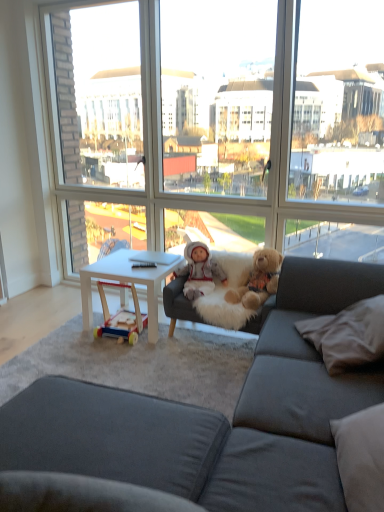
Question: Should I look upward or downward to see fluffy brown teddy bear at center?

Choices:
 (A) up
 (B) down

Answer: (B)

Question: Is white plush doll at center thinner than dark gray fabric couch at center?

Choices:
 (A) no
 (B) yes

Answer: (B)

Question: Can you confirm if white plush doll at center is positioned to the right of dark gray fabric couch at center?

Choices:
 (A) no
 (B) yes

Answer: (A)

Question: Can you confirm if white plush doll at center is shorter than dark gray fabric couch at center?

Choices:
 (A) yes
 (B) no

Answer: (A)

Question: Could you tell me if white plush doll at center is turned towards dark gray fabric couch at center?

Choices:
 (A) no
 (B) yes

Answer: (B)

Question: Is white plush doll at center bigger than dark gray fabric couch at center?

Choices:
 (A) yes
 (B) no

Answer: (B)

Question: Is white plush doll at center not inside dark gray fabric couch at center?

Choices:
 (A) yes
 (B) no

Answer: (B)

Question: Can you confirm if dark gray fabric couch at center is bigger than white soft pillow at lower right?

Choices:
 (A) yes
 (B) no

Answer: (A)

Question: Is dark gray fabric couch at center next to white soft pillow at lower right and touching it?

Choices:
 (A) yes
 (B) no

Answer: (B)

Question: Is dark gray fabric couch at center facing away from white soft pillow at lower right?

Choices:
 (A) no
 (B) yes

Answer: (B)

Question: From a real-world perspective, is dark gray fabric couch at center below white soft pillow at lower right?

Choices:
 (A) yes
 (B) no

Answer: (A)

Question: From a real-world perspective, is dark gray fabric couch at center physically above white soft pillow at lower right?

Choices:
 (A) yes
 (B) no

Answer: (B)

Question: Is dark gray fabric couch at center positioned behind white soft pillow at lower right?

Choices:
 (A) no
 (B) yes

Answer: (A)

Question: Is white plush doll at center directly adjacent to transparent glass window at center?

Choices:
 (A) no
 (B) yes

Answer: (A)